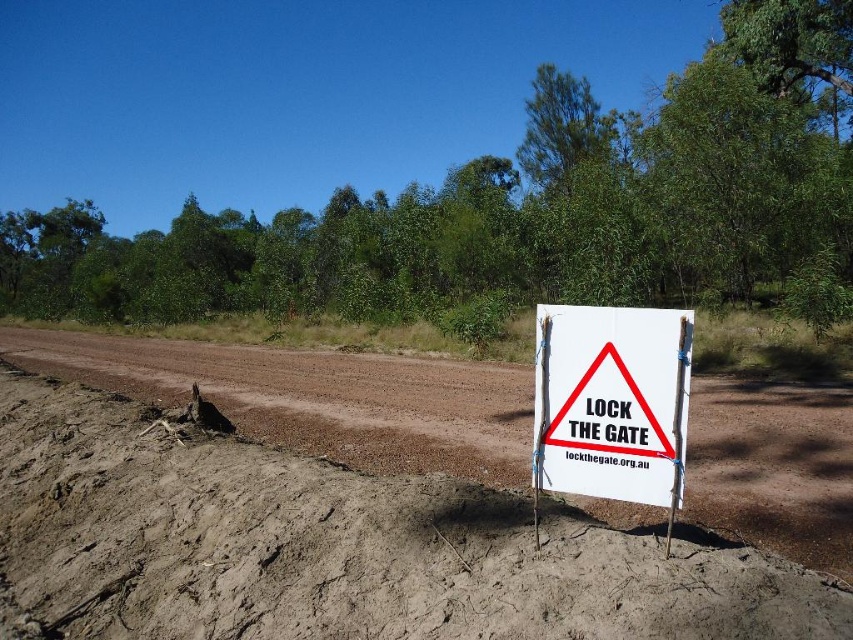
You are standing at the point marked as point [337,547] in the image. What is the color of the ground beneath your feet?

The ground beneath your feet at point [337,547] is brown dirt.